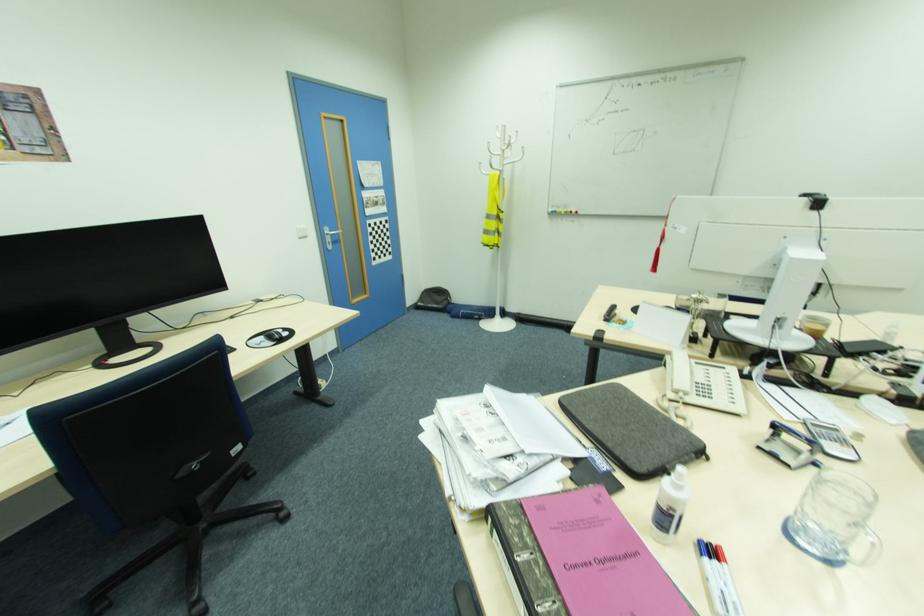
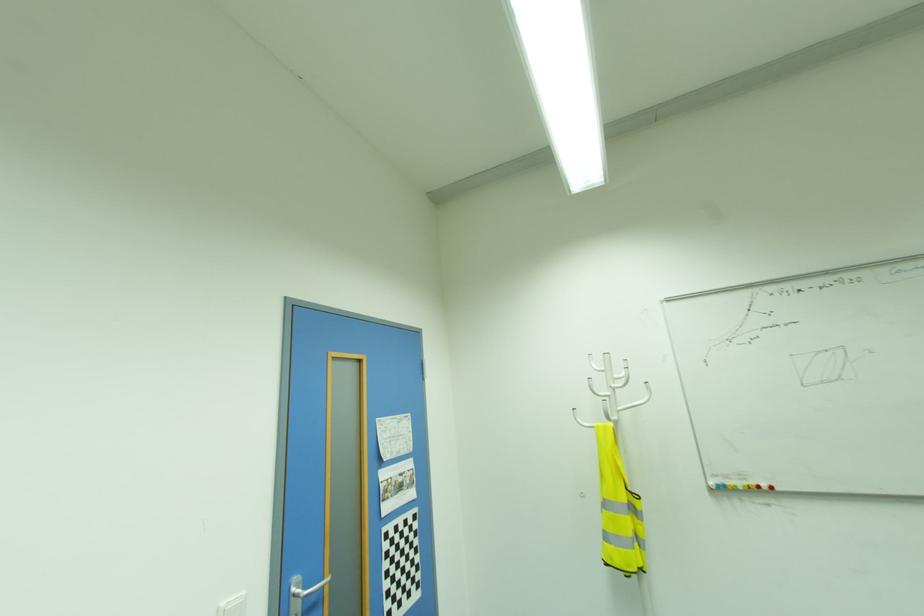
The point at (329, 232) is marked in the first image. Where is the corresponding point in the second image?

(296, 590)